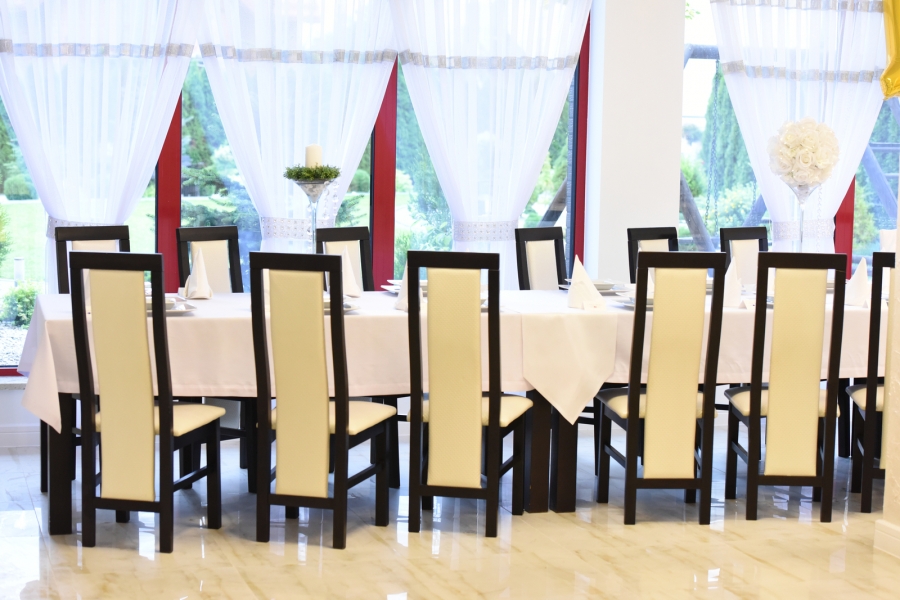
Locate an element on the screen. The image size is (900, 600). chair backs is located at coordinates (121, 327), (302, 323), (435, 318), (677, 318), (805, 316), (887, 336).